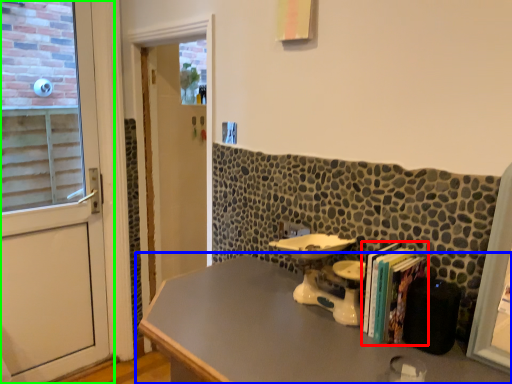
Question: Which is farther away from book (highlighted by a red box)? table (highlighted by a blue box) or door (highlighted by a green box)?

Choices:
 (A) table
 (B) door

Answer: (B)